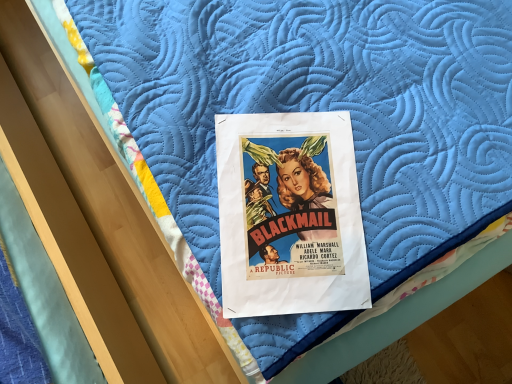
What do you see at coordinates (289, 215) in the screenshot? The image size is (512, 384). I see `vintage paper poster at center` at bounding box center [289, 215].

Image resolution: width=512 pixels, height=384 pixels. Identify the location of vintage paper poster at center. (289, 215).

At what (x,y) coordinates should I click in order to perform the action: click on vintage paper poster at center. Please return your answer as a coordinate pair (x, y). This screenshot has width=512, height=384. Looking at the image, I should click on (289, 215).